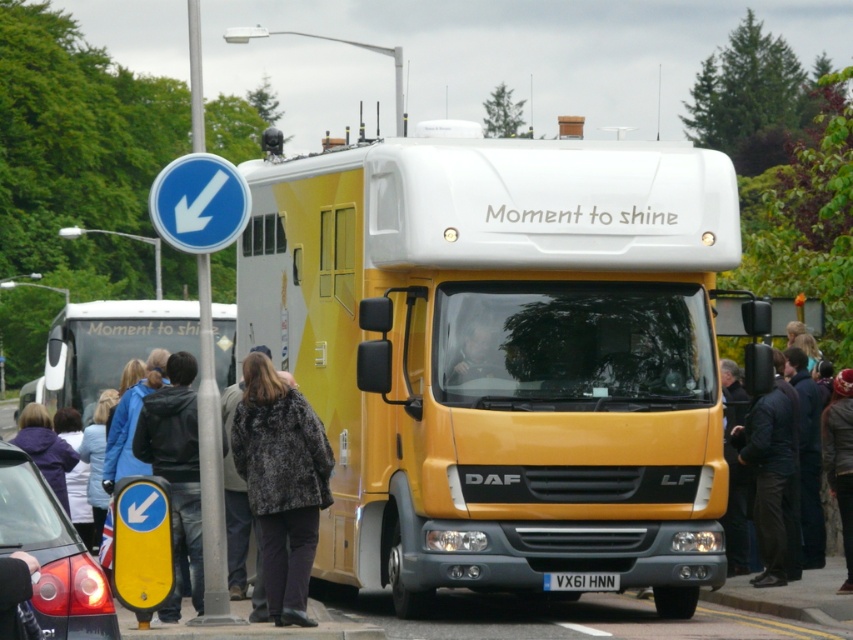
You are standing in front of the matte yellow truck at center and want to hand a jacket to someone wearing the fuzzy black coat at center. In which direction should you move relative to the truck to reach them?

The fuzzy black coat at center is located below the matte yellow truck at center, so you should move downward relative to the truck to reach them.

You are standing in front of the matte yellow truck at center and want to hand a document to someone wearing the fuzzy black coat at center. Can you directly hand it to them without moving from your current position?

The fuzzy black coat at center is closer to the viewer than the matte yellow truck at center, so yes, you can directly hand the document to them without moving since they are closer to you.